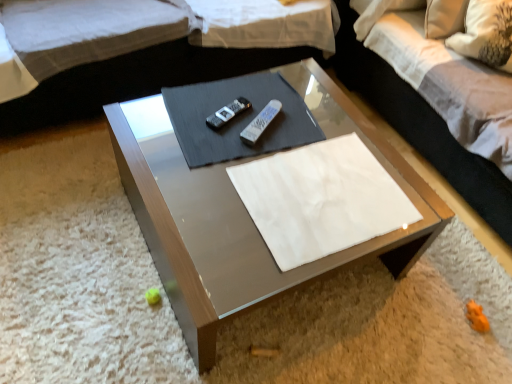
I want to click on vacant area that is situated to the right of black plastic remote at center, arranged as the second remote when viewed from the right, so click(x=284, y=121).